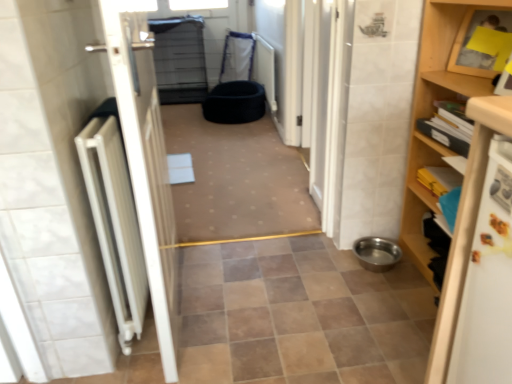
Where is `vacant region to the left of metallic stainless steel bowl at lower right, which is the 1th toilet bowl from right to left`? This screenshot has height=384, width=512. vacant region to the left of metallic stainless steel bowl at lower right, which is the 1th toilet bowl from right to left is located at coordinates (330, 266).